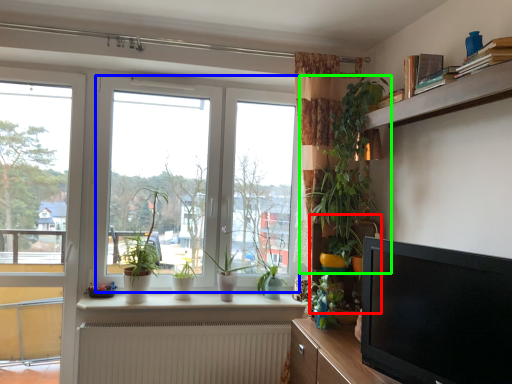
Question: Which object is the closest to the shelf (highlighted by a red box)? Choose among these: window (highlighted by a blue box) or houseplant (highlighted by a green box).

Choices:
 (A) window
 (B) houseplant

Answer: (B)